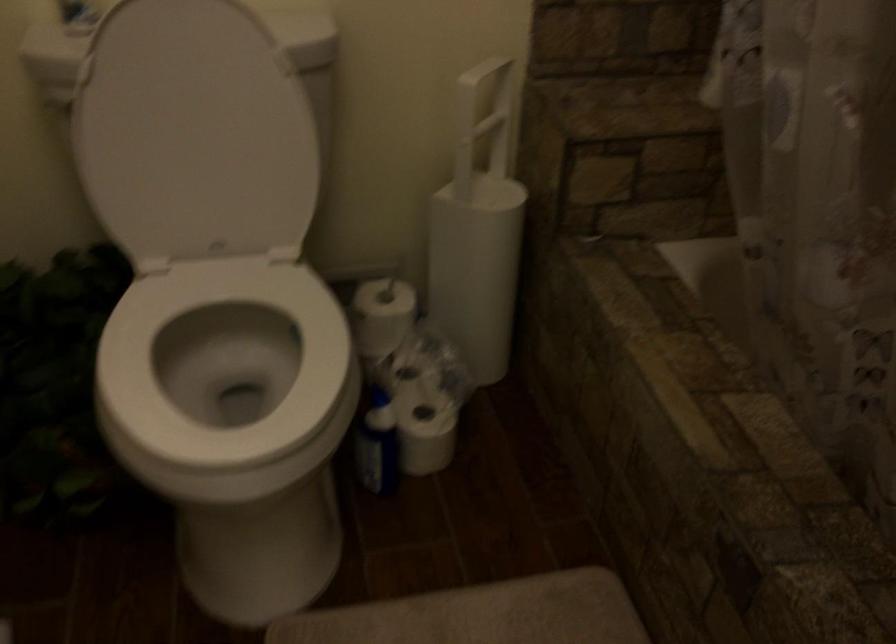
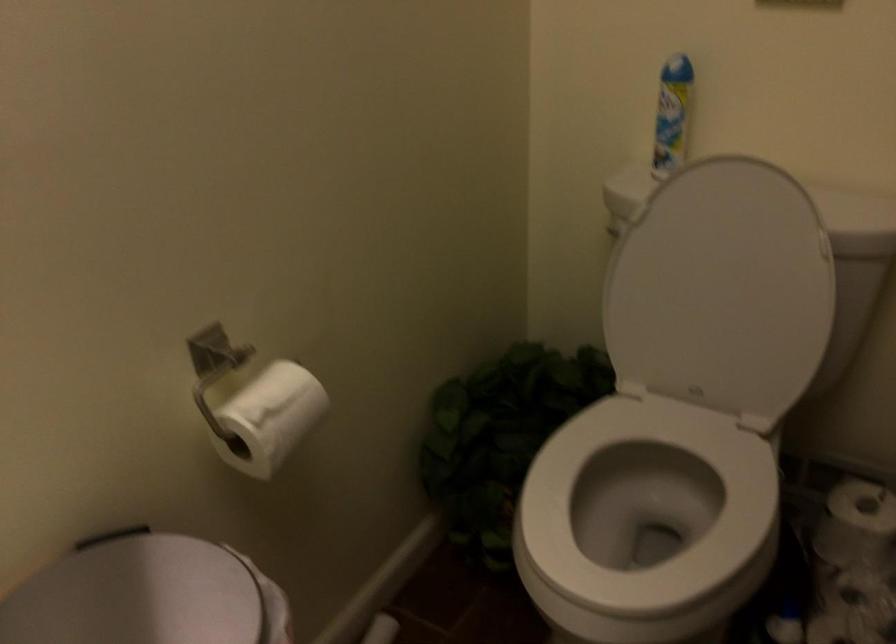
The point at (216, 131) is marked in the first image. Where is the corresponding point in the second image?

(721, 289)